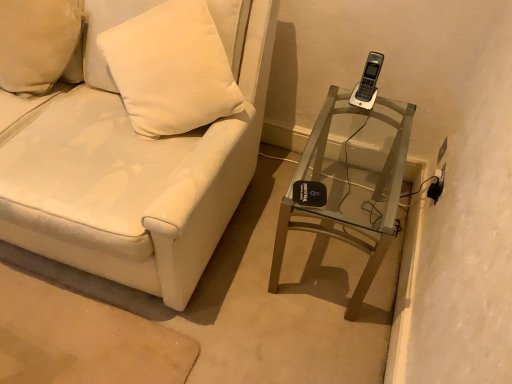
Question: Is clear glass table at right facing towards white leather couch at center?

Choices:
 (A) no
 (B) yes

Answer: (A)

Question: Is clear glass table at right positioned far away from white leather couch at center?

Choices:
 (A) yes
 (B) no

Answer: (B)

Question: Is clear glass table at right shorter than white leather couch at center?

Choices:
 (A) yes
 (B) no

Answer: (A)

Question: Is clear glass table at right thinner than white leather couch at center?

Choices:
 (A) yes
 (B) no

Answer: (A)

Question: Is white leather couch at center a part of clear glass table at right?

Choices:
 (A) yes
 (B) no

Answer: (B)

Question: Does clear glass table at right lie behind white leather couch at center?

Choices:
 (A) yes
 (B) no

Answer: (A)

Question: Is white matte pillow at upper left inside white leather couch at center?

Choices:
 (A) yes
 (B) no

Answer: (A)

Question: From a real-world perspective, is white leather couch at center located higher than white matte pillow at upper left?

Choices:
 (A) yes
 (B) no

Answer: (B)

Question: Considering the relative sizes of white leather couch at center and white matte pillow at upper left in the image provided, is white leather couch at center thinner than white matte pillow at upper left?

Choices:
 (A) yes
 (B) no

Answer: (B)

Question: Is white leather couch at center positioned before white matte pillow at upper left?

Choices:
 (A) yes
 (B) no

Answer: (A)

Question: From the image's perspective, is white leather couch at center on top of white matte pillow at upper left?

Choices:
 (A) yes
 (B) no

Answer: (B)

Question: Is white leather couch at center taller than white matte pillow at upper left?

Choices:
 (A) yes
 (B) no

Answer: (A)

Question: Can you confirm if clear glass table at right is taller than white matte pillow at upper left?

Choices:
 (A) no
 (B) yes

Answer: (B)